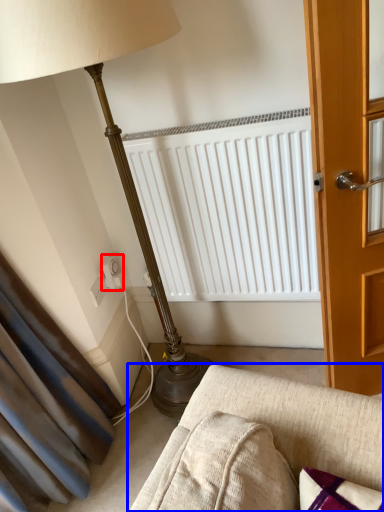
Question: Which object is closer to the camera taking this photo, electric outlet (highlighted by a red box) or studio couch (highlighted by a blue box)?

Choices:
 (A) electric outlet
 (B) studio couch

Answer: (B)